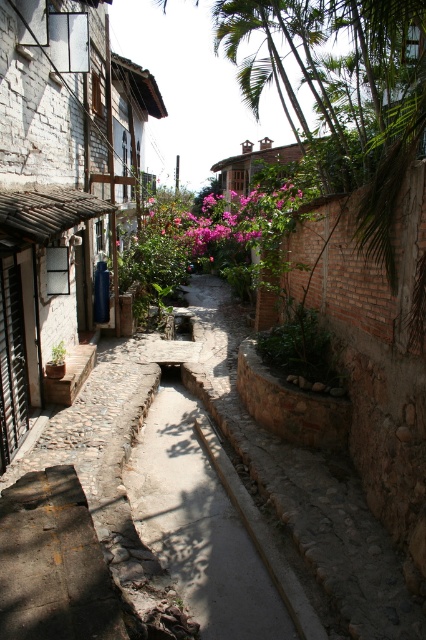
Can you confirm if pink matte flowers at center is positioned above green leafy plant at center?

Yes, pink matte flowers at center is above green leafy plant at center.

In the scene shown: Is pink matte flowers at center further to camera compared to green leafy plant at center?

Yes, pink matte flowers at center is behind green leafy plant at center.

This screenshot has height=640, width=426. I want to click on pink matte flowers at center, so click(x=227, y=220).

This screenshot has height=640, width=426. I want to click on pink matte flowers at center, so click(x=227, y=220).